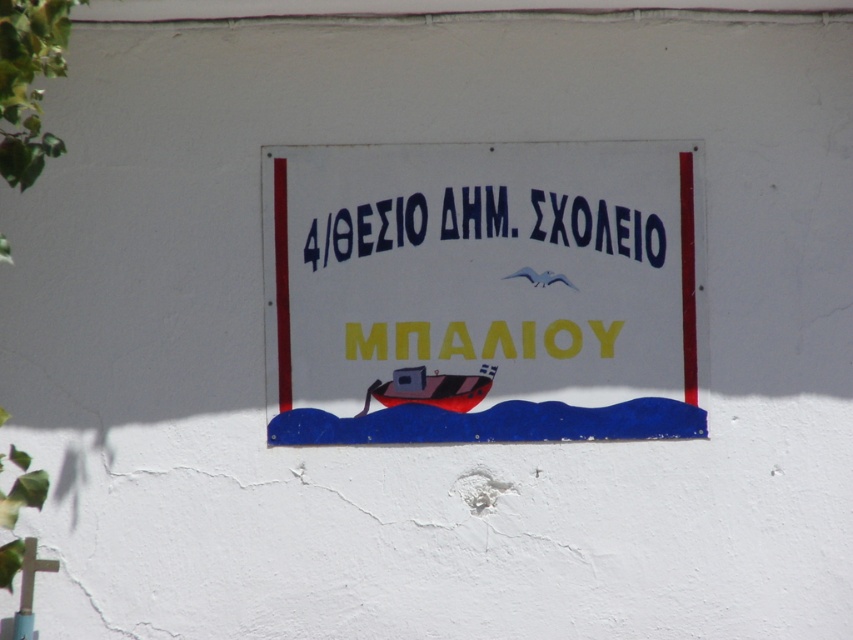
Is white plastic signboard at center shorter than black painted text at center?

Incorrect, white plastic signboard at center's height does not fall short of black painted text at center's.

Does white plastic signboard at center appear over black painted text at center?

No.

Where is `white plastic signboard at center`? white plastic signboard at center is located at coordinates pyautogui.click(x=483, y=291).

Find the location of `white plastic signboard at center`. white plastic signboard at center is located at coordinates (483, 291).

Can you confirm if white plastic signboard at center is positioned to the right of red matte boat at center?

Indeed, white plastic signboard at center is positioned on the right side of red matte boat at center.

Is point (695, 397) farther from camera compared to point (415, 403)?

Yes, point (695, 397) is farther from viewer.

Locate an element on the screen. This screenshot has height=640, width=853. white plastic signboard at center is located at coordinates (483, 291).

You are a GUI agent. You are given a task and a screenshot of the screen. Output one action in this format:
    pyautogui.click(x=<x>, y=<y>)
    Task: Click on the black painted text at center
    
    Given the screenshot: What is the action you would take?
    pyautogui.click(x=596, y=227)

Can you confirm if black painted text at center is wider than red matte boat at center?

Yes, black painted text at center is wider than red matte boat at center.

Who is more distant from viewer, [621,209] or [480,376]?

The point [621,209] is more distant.

In order to click on black painted text at center in this screenshot , I will do `click(596, 227)`.